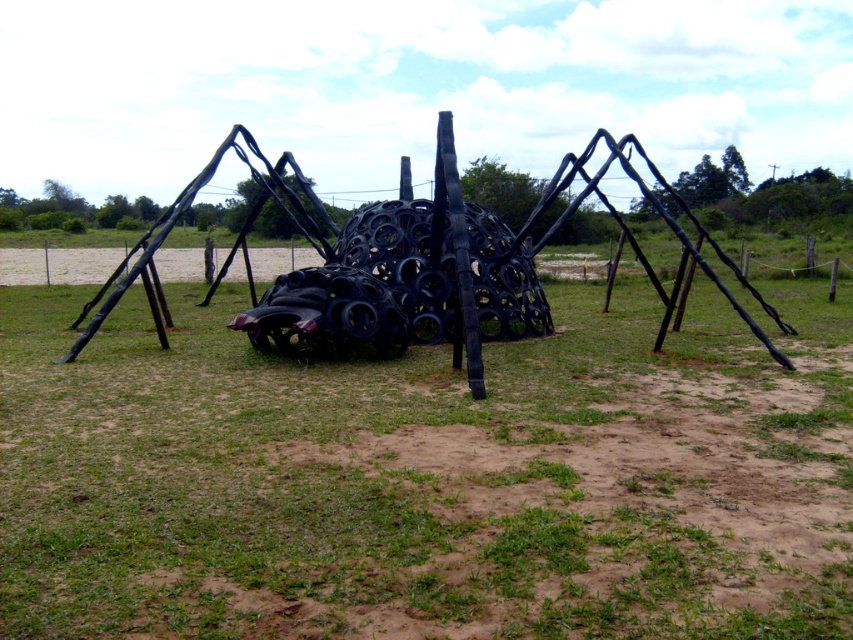
Can you confirm if brown soil at center is positioned below black matte sculpture at center?

Indeed, brown soil at center is positioned under black matte sculpture at center.

Locate an element on the screen. The height and width of the screenshot is (640, 853). brown soil at center is located at coordinates (428, 477).

Is point (22, 460) positioned before point (476, 250)?

Yes, point (22, 460) is closer to viewer.

Where is `brown soil at center`? Image resolution: width=853 pixels, height=640 pixels. brown soil at center is located at coordinates (428, 477).